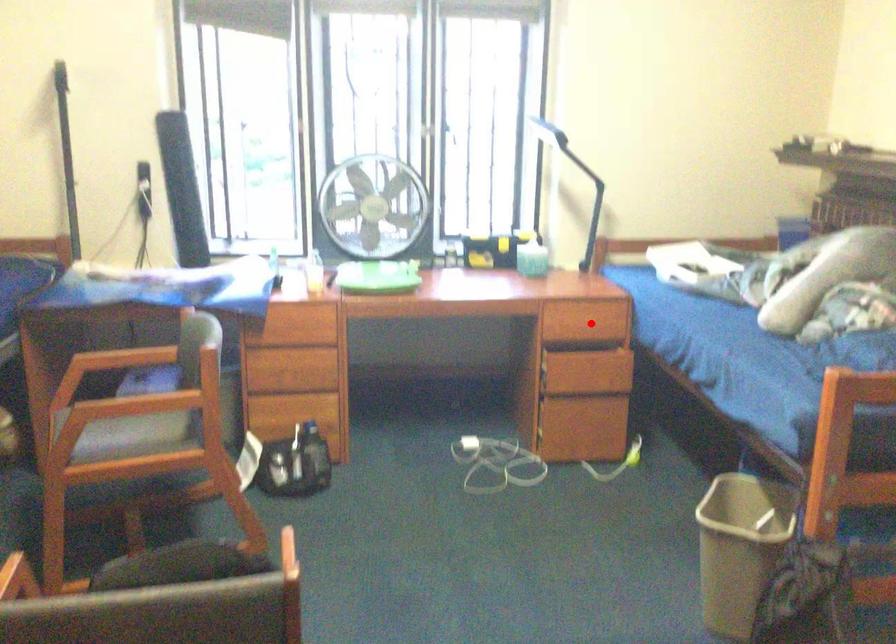
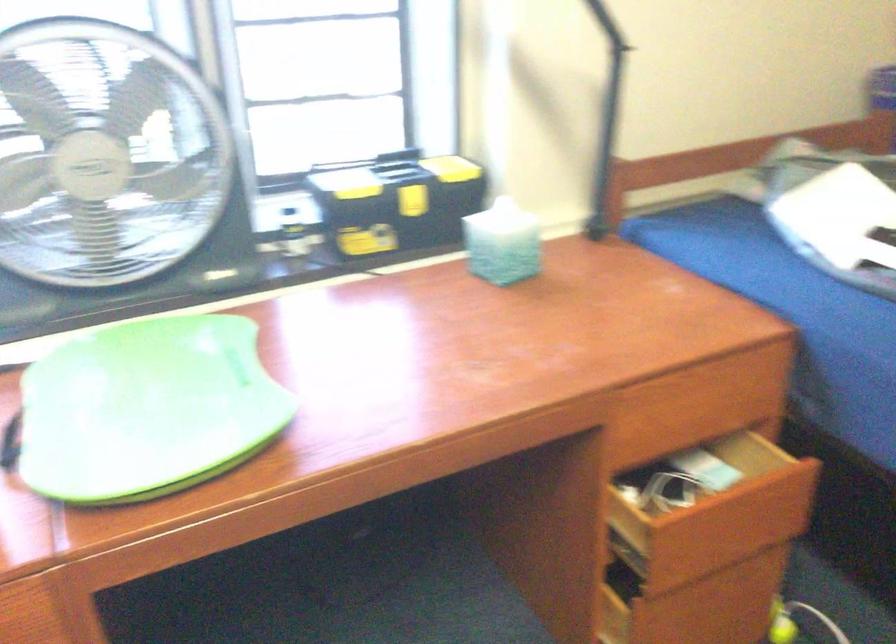
Question: I am providing you with two images of the same scene from different viewpoints. A red point is shown in image1. For the corresponding object point in image2, is it positioned nearer or farther from the camera?

Choices:
 (A) Nearer
 (B) Farther

Answer: (A)